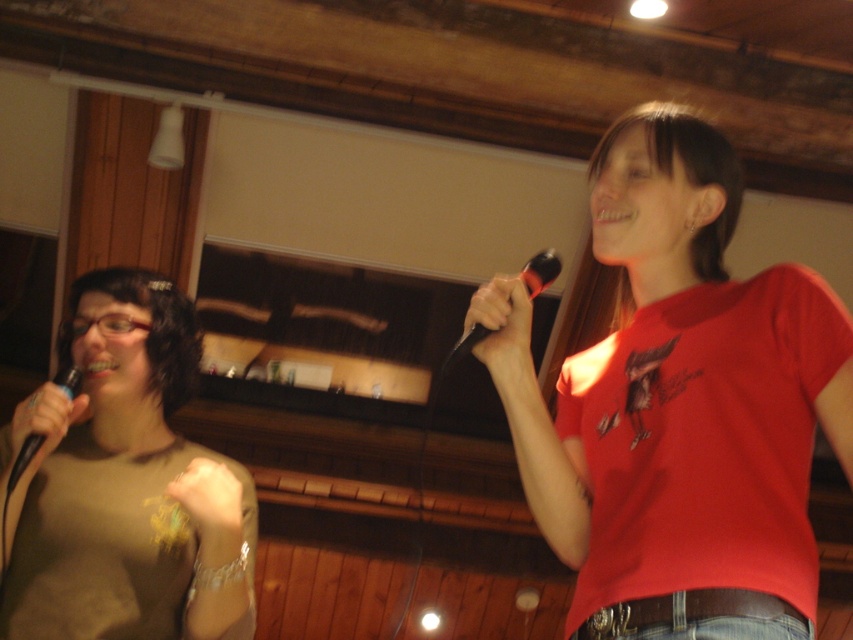
You are a photographer in the room and want to take a photo of both the matte brown shirt at left and the black rubber microphone at upper right. To ensure both are in focus, you need to know which object is taller. Which one is taller?

The matte brown shirt at left is much taller than the black rubber microphone at upper right, so you should focus on the matte brown shirt at left to ensure both are in focus.

You are organizing a karaoke night and need to ensure all participants have microphones. You notice the red matte shirt at center and the black rubber microphone at upper right in the image. Which item is larger in size?

The red matte shirt at center is bigger than the black rubber microphone at upper right, so the red matte shirt at center is larger in size.